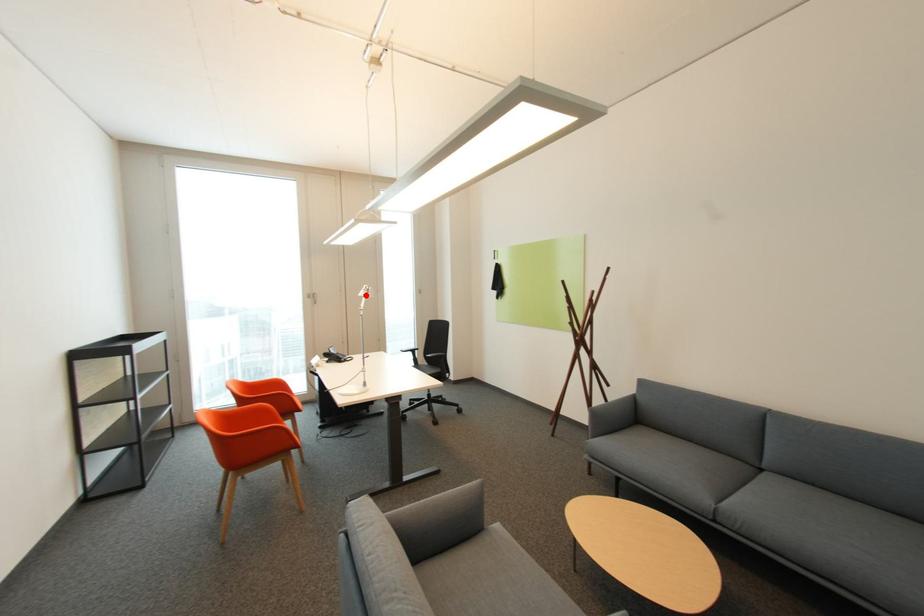
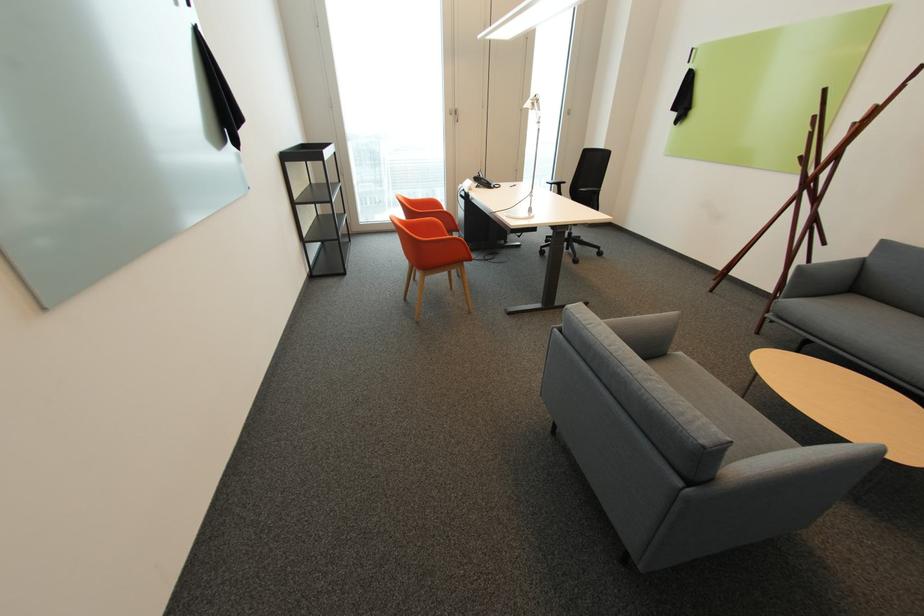
Locate, in the second image, the point that corresponds to the highlighted location in the first image.

(531, 107)